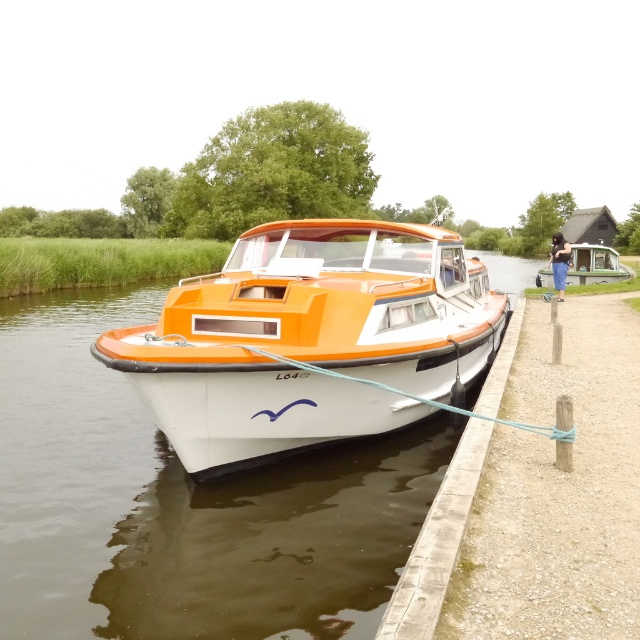
Between orange matte boat at center and green matte boat at right, which one has less height?

Standing shorter between the two is orange matte boat at center.

Does orange matte boat at center appear on the left side of green matte boat at right?

Indeed, orange matte boat at center is positioned on the left side of green matte boat at right.

Between point (236, 448) and point (593, 259), which one is positioned behind?

The point (593, 259) is behind.

You are a GUI agent. You are given a task and a screenshot of the screen. Output one action in this format:
    pyautogui.click(x=<x>, y=<y>)
    Task: Click on the orange matte boat at center
    
    Given the screenshot: What is the action you would take?
    pyautogui.click(x=310, y=339)